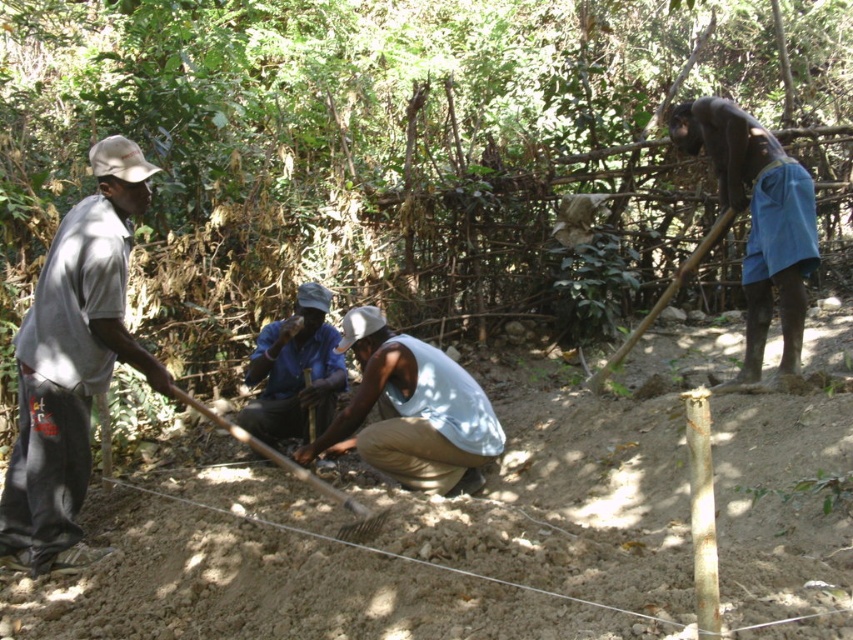
Which is behind, point (850, 516) or point (389, 412)?

Positioned behind is point (389, 412).

Which is behind, point (610, 618) or point (355, 440)?

Point (355, 440)

Identify the location of brown sandy soil at center. (268, 572).

You are a GUI agent. You are given a task and a screenshot of the screen. Output one action in this format:
    pyautogui.click(x=<x>, y=<y>)
    Task: Click on the gray cotton shirt at left
    Image resolution: width=853 pixels, height=640 pixels.
    Given the screenshot: What is the action you would take?
    pyautogui.click(x=73, y=364)

Does gray cotton shirt at left have a larger size compared to wooden shovel at right?

Actually, gray cotton shirt at left might be smaller than wooden shovel at right.

You are a GUI agent. You are given a task and a screenshot of the screen. Output one action in this format:
    pyautogui.click(x=<x>, y=<y>)
    Task: Click on the gray cotton shirt at left
    
    Given the screenshot: What is the action you would take?
    pyautogui.click(x=73, y=364)

Which is below, gray cotton shirt at left or blue fabric shorts at right?

gray cotton shirt at left

Who is positioned more to the left, gray cotton shirt at left or blue fabric shorts at right?

gray cotton shirt at left is more to the left.

Is point (102, 227) in front of point (796, 348)?

That is True.

At what (x,y) coordinates should I click in order to perform the action: click on gray cotton shirt at left. Please return your answer as a coordinate pair (x, y). The height and width of the screenshot is (640, 853). Looking at the image, I should click on (73, 364).